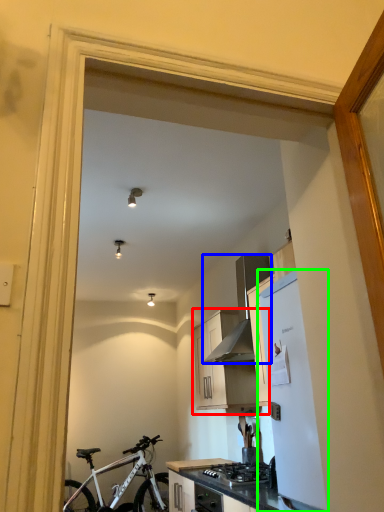
Question: Which object is the closest to the cabinetry (highlighted by a red box)? Choose among these: kitchen appliance (highlighted by a blue box) or refrigerator (highlighted by a green box).

Choices:
 (A) kitchen appliance
 (B) refrigerator

Answer: (A)